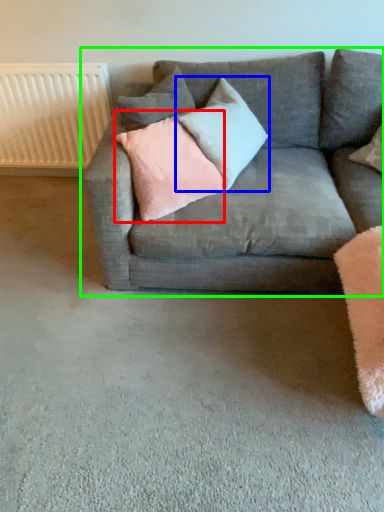
Question: Based on their relative distances, which object is nearer to pillow (highlighted by a red box)? Choose from pillow (highlighted by a blue box) and studio couch (highlighted by a green box).

Choices:
 (A) pillow
 (B) studio couch

Answer: (A)